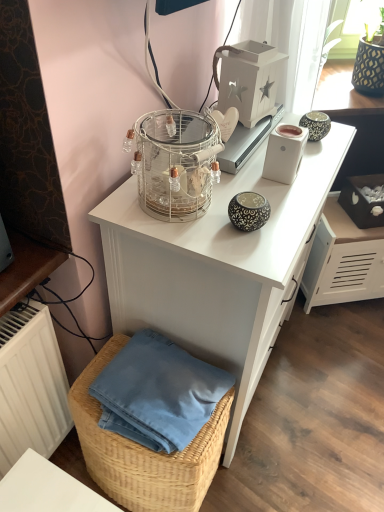
Find the location of a particular element. spots to the right of clear glass birdcage at upper center is located at coordinates (267, 202).